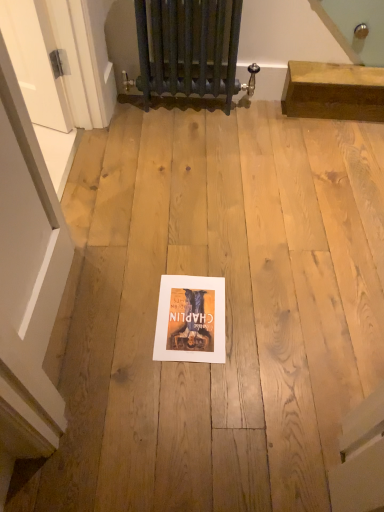
Locate an element on the screen. Image resolution: width=384 pixels, height=512 pixels. empty space that is to the right of matte paper postcard at center is located at coordinates (261, 312).